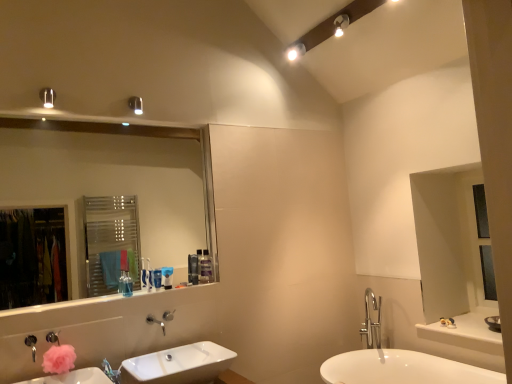
Locate an element on the screen. The height and width of the screenshot is (384, 512). vacant region above white glossy counter top at lower right (from a real-world perspective) is located at coordinates (466, 328).